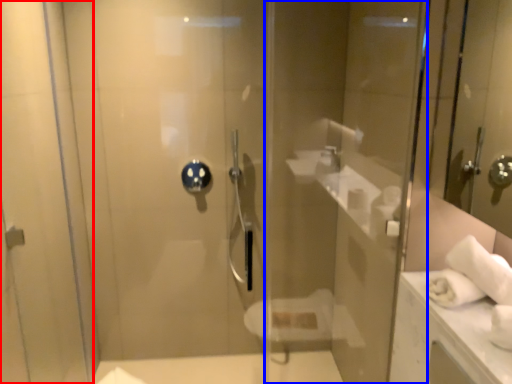
Question: Which object appears farthest to the camera in this image, screen door (highlighted by a red box) or glass door (highlighted by a blue box)?

Choices:
 (A) screen door
 (B) glass door

Answer: (B)